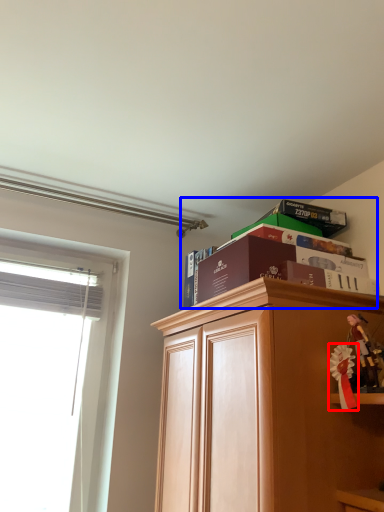
Question: Which point is closer to the camera, toy (highlighted by a red box) or book (highlighted by a blue box)?

Choices:
 (A) toy
 (B) book

Answer: (A)